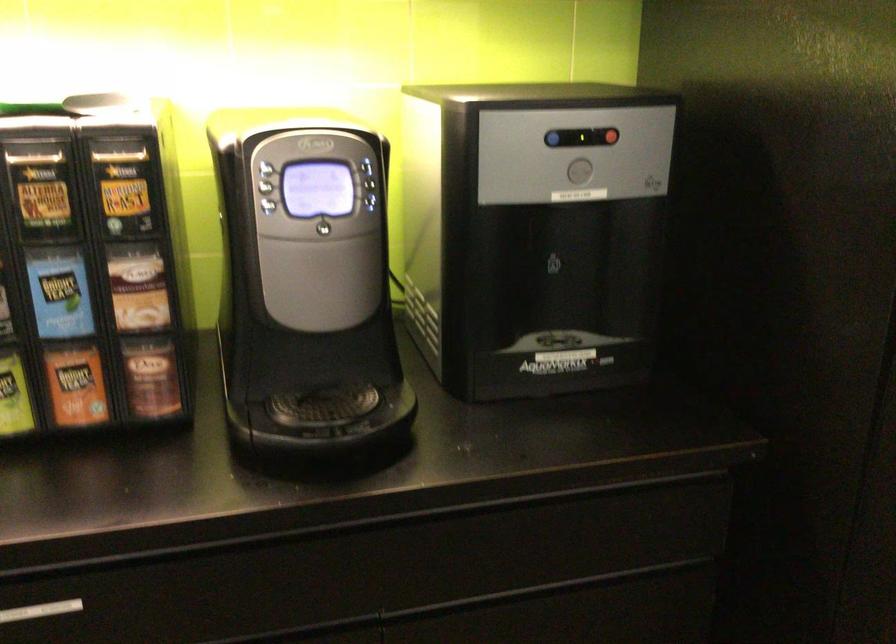
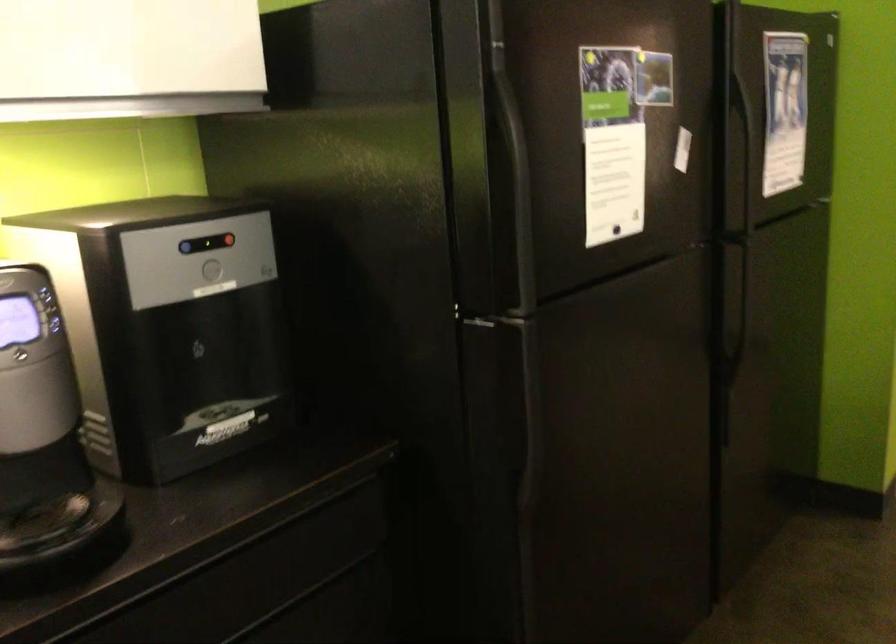
Find the pixel in the second image that matches point 581,167 in the first image.

(211, 269)